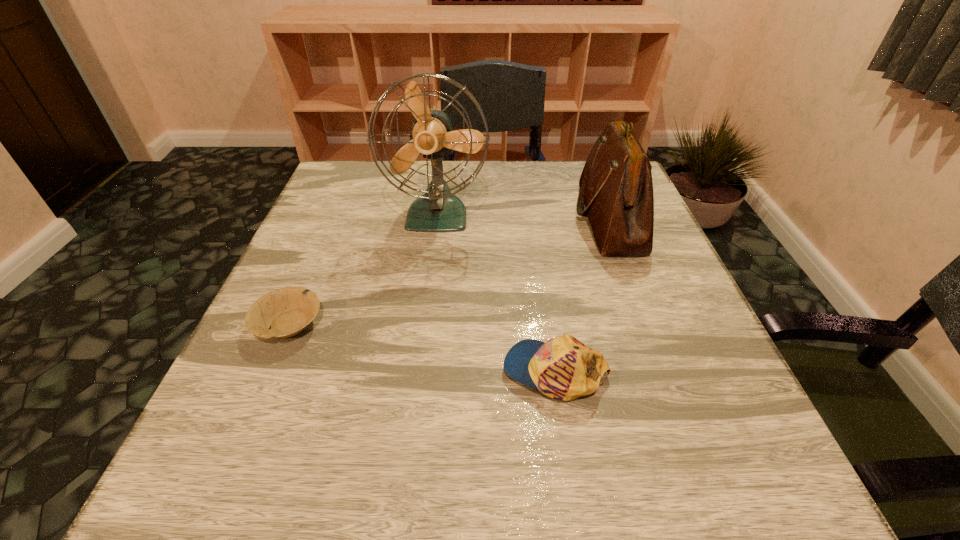
You are a GUI agent. You are given a task and a screenshot of the screen. Output one action in this format:
    pyautogui.click(x=<x>, y=<y>)
    Task: Click on the fan
    The height and width of the screenshot is (540, 960).
    Given the screenshot: What is the action you would take?
    pyautogui.click(x=438, y=210)

The height and width of the screenshot is (540, 960). In order to click on the tallest object in this screenshot , I will do `click(438, 210)`.

At what (x,y) coordinates should I click in order to perform the action: click on the second tallest object. Please return your answer as a coordinate pair (x, y). The height and width of the screenshot is (540, 960). Looking at the image, I should click on (616, 187).

Locate an element on the screen. This screenshot has width=960, height=540. shoulder bag is located at coordinates (616, 187).

Identify the location of the third object from left to right. The width and height of the screenshot is (960, 540). (563, 368).

You are a GUI agent. You are given a task and a screenshot of the screen. Output one action in this format:
    pyautogui.click(x=<x>, y=<y>)
    Task: Click on the cap
    The width and height of the screenshot is (960, 540).
    Given the screenshot: What is the action you would take?
    pyautogui.click(x=563, y=368)

You are a GUI agent. You are given a task and a screenshot of the screen. Output one action in this format:
    pyautogui.click(x=<x>, y=<y>)
    Task: Click on the bowl
    The height and width of the screenshot is (540, 960).
    Given the screenshot: What is the action you would take?
    pyautogui.click(x=287, y=311)

Image resolution: width=960 pixels, height=540 pixels. Identify the location of the leftmost object. (287, 311).

Identify the location of vacant region located on the front-facing side of the tallest object for air flow. (426, 304).

Locate an element on the screen. The width and height of the screenshot is (960, 540). free space located on the left of the rightmost object is located at coordinates (472, 219).